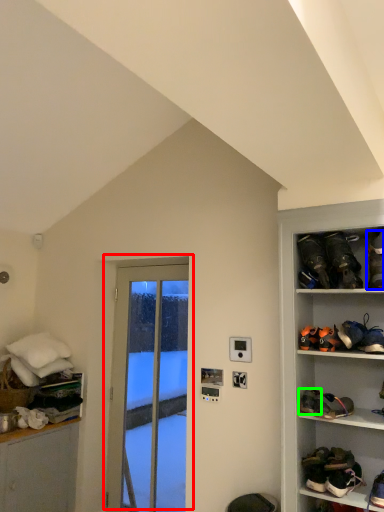
Question: Which is farther away from door (highlighted by a red box)? footwear (highlighted by a blue box) or footwear (highlighted by a green box)?

Choices:
 (A) footwear
 (B) footwear

Answer: (A)